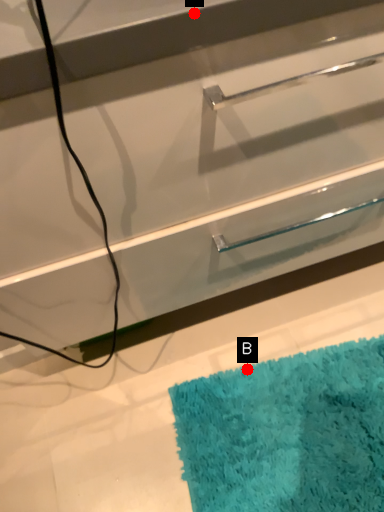
Question: Two points are circled on the image, labeled by A and B beside each circle. Which point is closer to the camera taking this photo?

Choices:
 (A) A is closer
 (B) B is closer

Answer: (A)